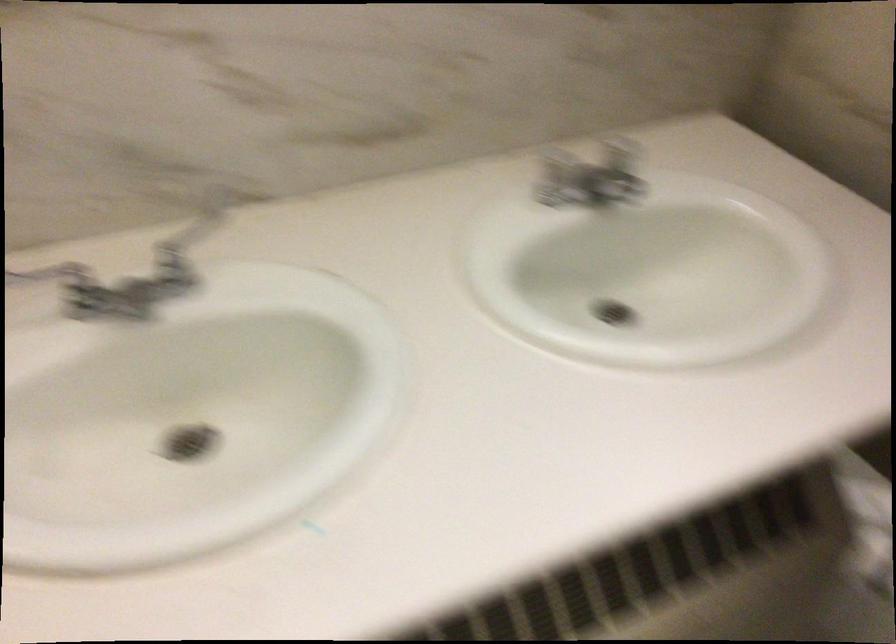
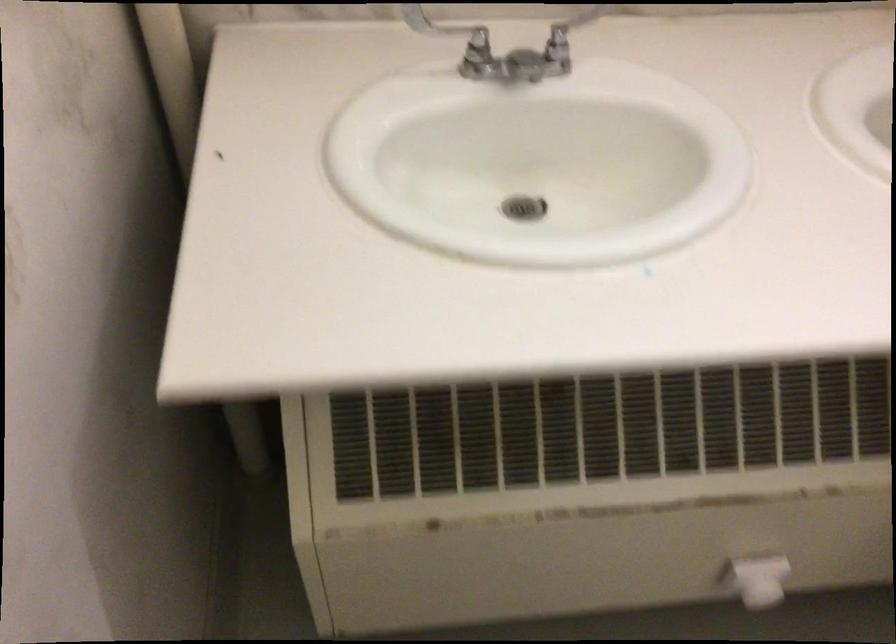
Find the pixel in the second image that matches pixel 88 272 in the first image.

(476, 37)